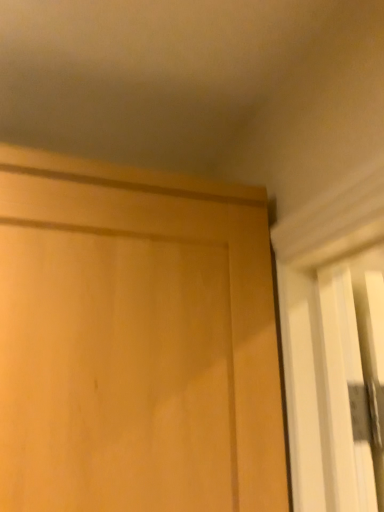
Question: Should I look upward or downward to see light wood door at center?

Choices:
 (A) up
 (B) down

Answer: (B)